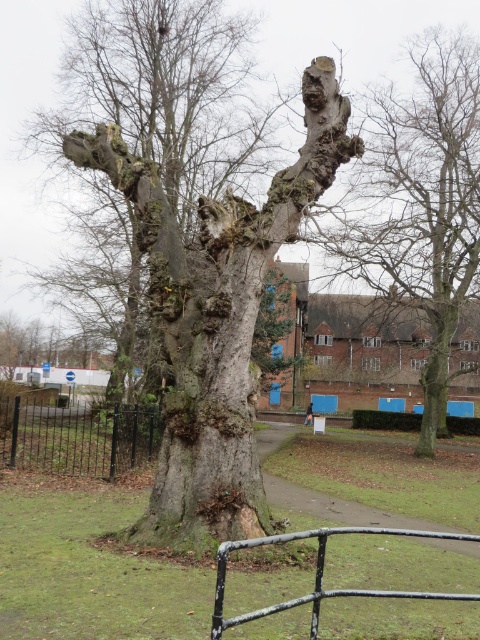
Question: Does smooth gray bark at center come in front of smooth bark tree at upper right?

Choices:
 (A) no
 (B) yes

Answer: (B)

Question: Which point appears farthest from the camera in this image?

Choices:
 (A) (24, 419)
 (B) (408, 296)

Answer: (B)

Question: Based on their relative distances, which object is nearer to the smooth bark tree at upper right?

Choices:
 (A) smooth gray bark at center
 (B) black metal fence at left
 (C) black metal rail at lower center

Answer: (A)

Question: Is smooth bark tree at upper right positioned in front of black metal rail at lower center?

Choices:
 (A) no
 (B) yes

Answer: (A)

Question: Among these objects, which one is nearest to the camera?

Choices:
 (A) black metal rail at lower center
 (B) smooth bark tree at upper right

Answer: (A)

Question: Does smooth gray bark at center appear under smooth bark tree at upper right?

Choices:
 (A) yes
 (B) no

Answer: (A)